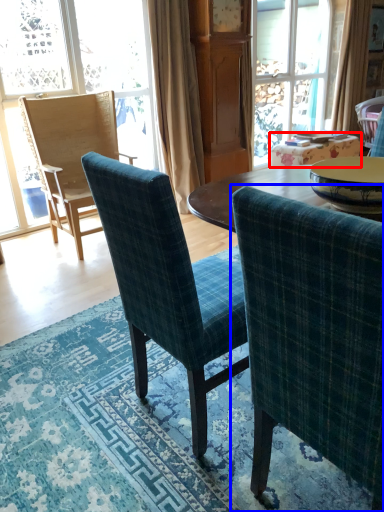
Question: Which object appears closest to the camera in this image, table (highlighted by a red box) or chair (highlighted by a blue box)?

Choices:
 (A) table
 (B) chair

Answer: (B)